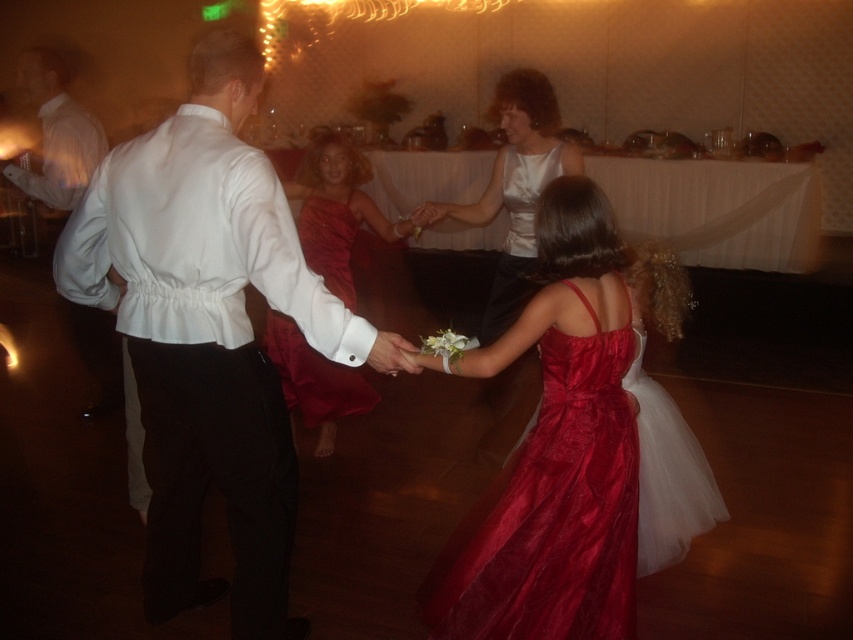
Can you confirm if satin white dress at center is taller than shiny satin dress at lower right?

Correct, satin white dress at center is much taller as shiny satin dress at lower right.

Between point (558, 154) and point (651, 538), which one is positioned in front?

Point (651, 538) is more forward.

Who is more forward, (x=569, y=168) or (x=637, y=380)?

Point (x=637, y=380) is more forward.

Find the location of `satin white dress at center`. satin white dress at center is located at coordinates (514, 188).

Between shiny satin dress at lower right and satin dress at center, which one appears on the left side from the viewer's perspective?

From the viewer's perspective, satin dress at center appears more on the left side.

This screenshot has width=853, height=640. What do you see at coordinates (666, 465) in the screenshot?
I see `shiny satin dress at lower right` at bounding box center [666, 465].

Where is `shiny satin dress at lower right`? shiny satin dress at lower right is located at coordinates (666, 465).

Is satin white dress at center taller than satin dress at center?

Correct, satin white dress at center is much taller as satin dress at center.

Which is behind, point (564, 173) or point (305, 401)?

Point (305, 401)

At what (x,y) coordinates should I click in order to perform the action: click on satin white dress at center. Please return your answer as a coordinate pair (x, y). This screenshot has height=640, width=853. Looking at the image, I should click on (514, 188).

Where is `satin white dress at center`? satin white dress at center is located at coordinates (514, 188).